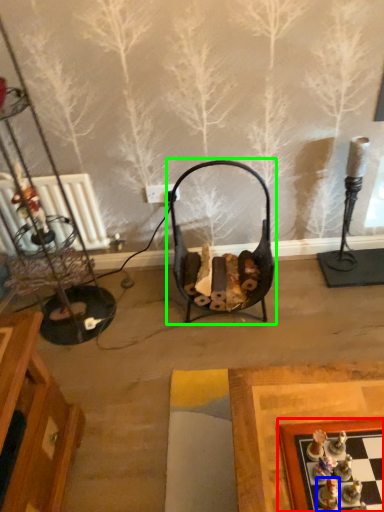
Question: Which object is the farthest from board game (highlighted by a red box)? Choose among these: toy (highlighted by a blue box) or swivel chair (highlighted by a green box).

Choices:
 (A) toy
 (B) swivel chair

Answer: (B)